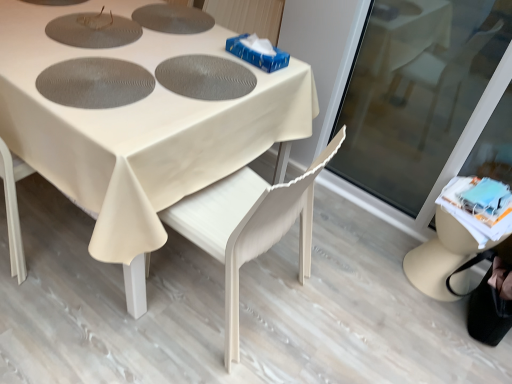
Question: Is white fabric table at center inside transparent glass screen door at lower right?

Choices:
 (A) yes
 (B) no

Answer: (B)

Question: Considering the relative positions of transparent glass screen door at lower right and white fabric table at center in the image provided, is transparent glass screen door at lower right to the left of white fabric table at center from the viewer's perspective?

Choices:
 (A) yes
 (B) no

Answer: (B)

Question: Is transparent glass screen door at lower right positioned beyond the bounds of white fabric table at center?

Choices:
 (A) yes
 (B) no

Answer: (A)

Question: From the image's perspective, is transparent glass screen door at lower right under white fabric table at center?

Choices:
 (A) no
 (B) yes

Answer: (B)

Question: Is transparent glass screen door at lower right wider than white fabric table at center?

Choices:
 (A) yes
 (B) no

Answer: (B)

Question: Considering the relative positions of transparent glass screen door at lower right and white fabric table at center in the image provided, is transparent glass screen door at lower right to the right of white fabric table at center from the viewer's perspective?

Choices:
 (A) no
 (B) yes

Answer: (B)

Question: From the image's perspective, is transparent glass screen door at lower right located beneath white wood chair at center?

Choices:
 (A) yes
 (B) no

Answer: (B)

Question: Is white wood chair at center at the back of transparent glass screen door at lower right?

Choices:
 (A) yes
 (B) no

Answer: (B)

Question: Is transparent glass screen door at lower right wider than white wood chair at center?

Choices:
 (A) no
 (B) yes

Answer: (A)

Question: Can you confirm if transparent glass screen door at lower right is bigger than white wood chair at center?

Choices:
 (A) no
 (B) yes

Answer: (A)

Question: From a real-world perspective, is transparent glass screen door at lower right located higher than white wood chair at center?

Choices:
 (A) no
 (B) yes

Answer: (B)

Question: Can you confirm if transparent glass screen door at lower right is shorter than white wood chair at center?

Choices:
 (A) yes
 (B) no

Answer: (B)

Question: Can you confirm if white fabric table at center is positioned to the right of transparent glass screen door at lower right?

Choices:
 (A) yes
 (B) no

Answer: (B)